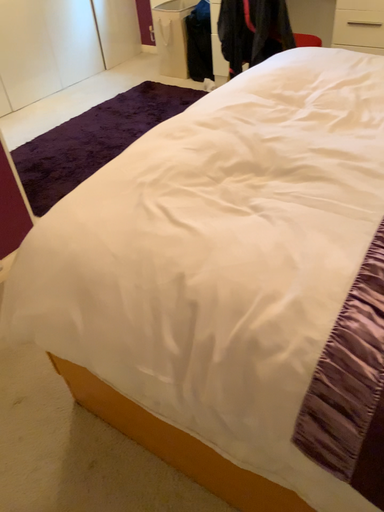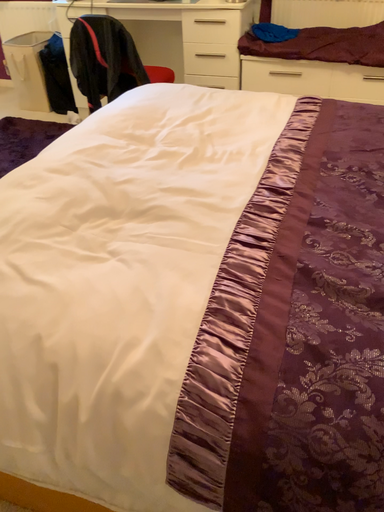
Question: Which way did the camera rotate in the video?

Choices:
 (A) rotated left
 (B) rotated right

Answer: (B)